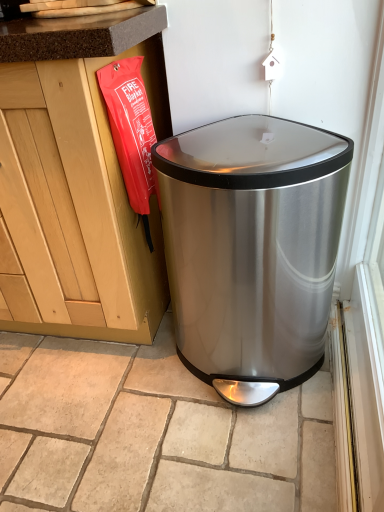
Identify the location of beige stone tile at center. Image resolution: width=384 pixels, height=512 pixels. (152, 433).

The width and height of the screenshot is (384, 512). Describe the element at coordinates (152, 433) in the screenshot. I see `beige stone tile at center` at that location.

What do you see at coordinates (252, 248) in the screenshot? I see `stainless steel trash can at lower right` at bounding box center [252, 248].

What is the approximate height of stainless steel trash can at lower right?

stainless steel trash can at lower right is 26.46 inches tall.

Where is `stainless steel trash can at lower right`? The image size is (384, 512). stainless steel trash can at lower right is located at coordinates (252, 248).

What is the approximate width of stainless steel trash can at lower right?

stainless steel trash can at lower right is 17.55 inches in width.

Locate an element on the screen. The width and height of the screenshot is (384, 512). beige stone tile at center is located at coordinates (152, 433).

Visually, is stainless steel trash can at lower right positioned to the left or to the right of beige stone tile at center?

stainless steel trash can at lower right is to the right of beige stone tile at center.

Does stainless steel trash can at lower right lie behind beige stone tile at center?

No, stainless steel trash can at lower right is in front of beige stone tile at center.

Which is nearer, (266,382) or (308,488)?

Point (266,382) is farther from the camera than point (308,488).

From the image's perspective, is stainless steel trash can at lower right positioned above or below beige stone tile at center?

Based on their image positions, stainless steel trash can at lower right is located above beige stone tile at center.

From a real-world perspective, is stainless steel trash can at lower right positioned above or below beige stone tile at center?

Clearly, from a real-world perspective, stainless steel trash can at lower right is above beige stone tile at center.

Considering the sizes of objects stainless steel trash can at lower right and beige stone tile at center in the image provided, who is thinner, stainless steel trash can at lower right or beige stone tile at center?

Thinner between the two is stainless steel trash can at lower right.

Can you confirm if stainless steel trash can at lower right is shorter than beige stone tile at center?

Incorrect, the height of stainless steel trash can at lower right does not fall short of that of beige stone tile at center.

Between stainless steel trash can at lower right and beige stone tile at center, which one has larger size?

Bigger between the two is stainless steel trash can at lower right.

Is stainless steel trash can at lower right situated inside beige stone tile at center or outside?

stainless steel trash can at lower right lies outside beige stone tile at center.

Is stainless steel trash can at lower right next to beige stone tile at center?

stainless steel trash can at lower right and beige stone tile at center are clearly separated.

Is beige stone tile at center at the back of stainless steel trash can at lower right?

No, stainless steel trash can at lower right is not facing the opposite direction of beige stone tile at center.

How different are the orientations of stainless steel trash can at lower right and beige stone tile at center in degrees?

stainless steel trash can at lower right and beige stone tile at center are facing 88.7 degrees away from each other.

In the image, there is a stainless steel trash can at lower right. Where is `tile below it (from a real-world perspective)`? This screenshot has height=512, width=384. tile below it (from a real-world perspective) is located at coordinates (x=152, y=433).

Which is more to the right, beige stone tile at center or stainless steel trash can at lower right?

Positioned to the right is stainless steel trash can at lower right.

Relative to stainless steel trash can at lower right, is beige stone tile at center in front or behind?

In the image, beige stone tile at center appears behind stainless steel trash can at lower right.

Does point (110, 392) lie in front of point (291, 217)?

No.

Based on the photo, from the image's perspective, between beige stone tile at center and stainless steel trash can at lower right, which one is located above?

From the image's view, stainless steel trash can at lower right is above.

From a real-world perspective, is beige stone tile at center physically below stainless steel trash can at lower right?

Indeed, from a real-world perspective, beige stone tile at center is positioned beneath stainless steel trash can at lower right.

Is beige stone tile at center wider than stainless steel trash can at lower right?

Indeed, beige stone tile at center has a greater width compared to stainless steel trash can at lower right.

Which of these two, beige stone tile at center or stainless steel trash can at lower right, stands taller?

stainless steel trash can at lower right.

Can you confirm if beige stone tile at center is bigger than stainless steel trash can at lower right?

No.

Is beige stone tile at center positioned beyond the bounds of stainless steel trash can at lower right?

beige stone tile at center is positioned outside stainless steel trash can at lower right.

Would you consider beige stone tile at center to be distant from stainless steel trash can at lower right?

No, there isn't a large distance between beige stone tile at center and stainless steel trash can at lower right.

Is stainless steel trash can at lower right at the back of beige stone tile at center?

No, beige stone tile at center's orientation is not away from stainless steel trash can at lower right.

Can you tell me how much beige stone tile at center and stainless steel trash can at lower right differ in facing direction?

88.7 degrees separate the facing orientations of beige stone tile at center and stainless steel trash can at lower right.

This screenshot has height=512, width=384. In order to click on waste container in front of the beige stone tile at center in this screenshot , I will do `click(252, 248)`.

You are a GUI agent. You are given a task and a screenshot of the screen. Output one action in this format:
    pyautogui.click(x=<x>, y=<y>)
    Task: Click on the waste container that appears in front of the beige stone tile at center
    
    Given the screenshot: What is the action you would take?
    pyautogui.click(x=252, y=248)

The height and width of the screenshot is (512, 384). Find the location of `tile on the left of stainless steel trash can at lower right`. tile on the left of stainless steel trash can at lower right is located at coordinates (152, 433).